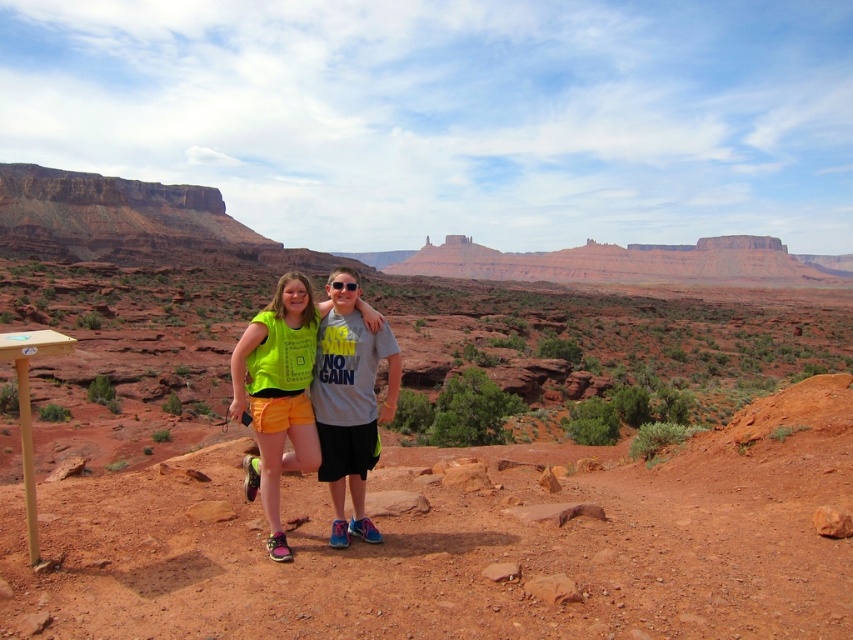
Can you confirm if neon yellow fabric at center is wider than glossy plastic goggles at center?

Yes, neon yellow fabric at center is wider than glossy plastic goggles at center.

Does point (306, 422) lie behind point (337, 288)?

That is False.

You are a GUI agent. You are given a task and a screenshot of the screen. Output one action in this format:
    pyautogui.click(x=<x>, y=<y>)
    Task: Click on the neon yellow fabric at center
    Image resolution: width=853 pixels, height=640 pixels.
    Given the screenshot: What is the action you would take?
    pyautogui.click(x=277, y=394)

Is neon yellow fabric at center smaller than matte gray t-shirt at center?

Actually, neon yellow fabric at center might be larger than matte gray t-shirt at center.

Identify the location of neon yellow fabric at center. Image resolution: width=853 pixels, height=640 pixels. (277, 394).

Can you confirm if matte gray t-shirt at center is bigger than glossy plastic goggles at center?

Correct, matte gray t-shirt at center is larger in size than glossy plastic goggles at center.

The image size is (853, 640). What do you see at coordinates (350, 408) in the screenshot?
I see `matte gray t-shirt at center` at bounding box center [350, 408].

Who is more forward, (323, 444) or (335, 284)?

Point (323, 444) is more forward.

This screenshot has height=640, width=853. What are the coordinates of `matte gray t-shirt at center` in the screenshot? It's located at (350, 408).